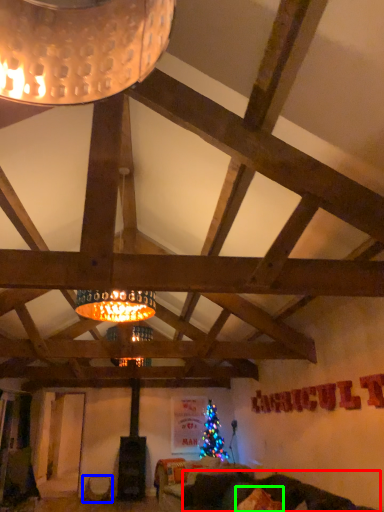
Question: Which object is the closest to the couch (highlighted by a red box)? Choose among these: furniture (highlighted by a blue box) or pillow (highlighted by a green box).

Choices:
 (A) furniture
 (B) pillow

Answer: (B)